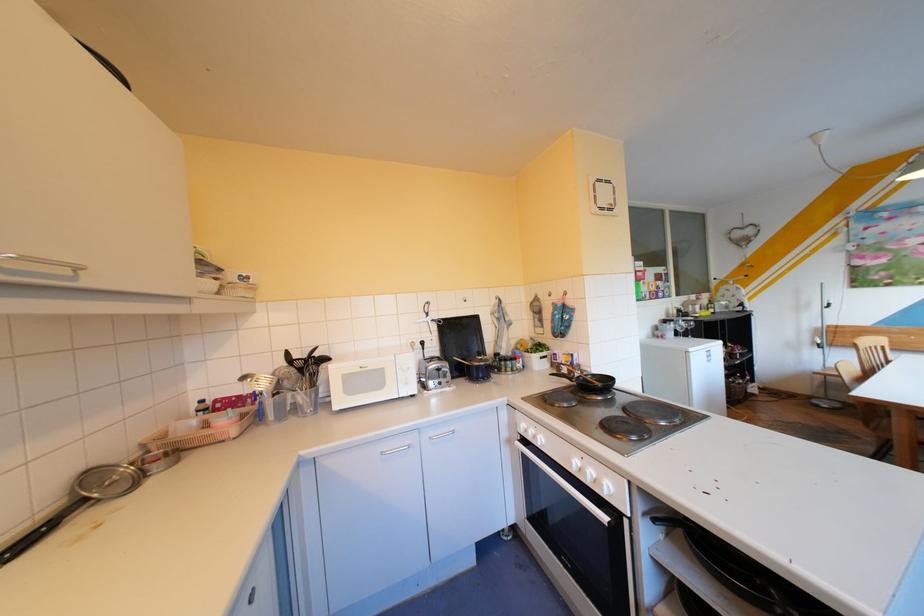
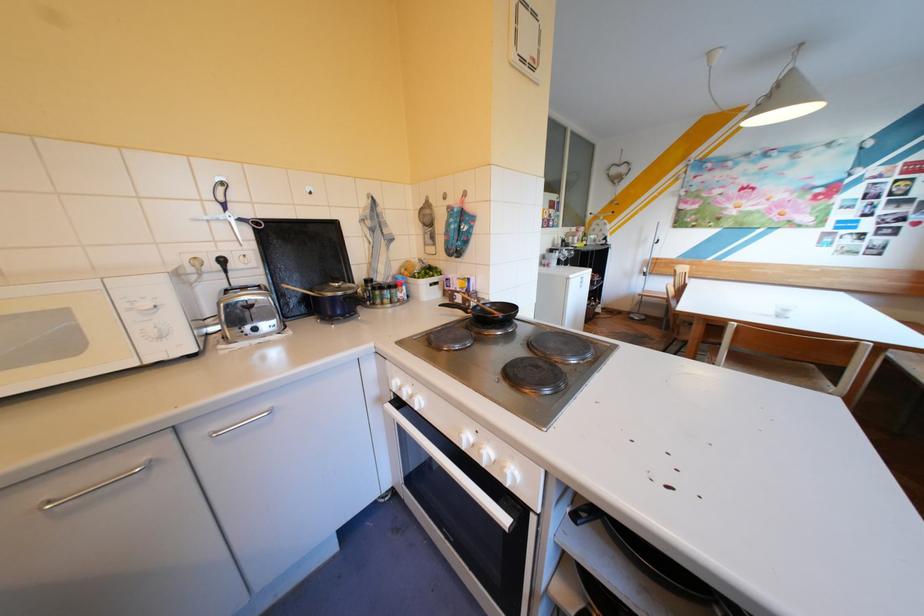
Locate, in the second image, the point that corresponds to point (444, 434) in the first image.

(226, 427)